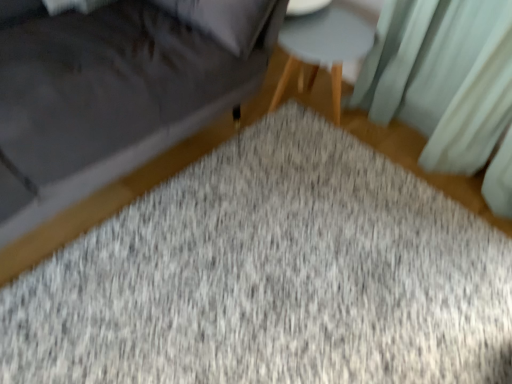
Identify the location of light gray wood stool at center. This screenshot has width=512, height=384. (322, 48).

Where is `velvet gray sofa at lower left`? This screenshot has height=384, width=512. velvet gray sofa at lower left is located at coordinates (159, 147).

You are a GUI agent. You are given a task and a screenshot of the screen. Output one action in this format:
    pyautogui.click(x=<x>, y=<y>)
    Task: Click on the gray textured mat at center
    
    Given the screenshot: What is the action you would take?
    pyautogui.click(x=272, y=277)

Which object is closer to the camera taking this photo, velvet gray sofa at lower left or gray textured mat at center?

velvet gray sofa at lower left.

Does velvet gray sofa at lower left have a greater width compared to gray textured mat at center?

No.

From the image's perspective, which is above, velvet gray sofa at lower left or gray textured mat at center?

velvet gray sofa at lower left appears higher in the image.

Is velvet gray sofa at lower left facing away from light gray wood stool at center?

No, velvet gray sofa at lower left is not facing the opposite direction of light gray wood stool at center.

Is velvet gray sofa at lower left touching light gray wood stool at center?

No, velvet gray sofa at lower left is not beside light gray wood stool at center.

Between velvet gray sofa at lower left and light gray wood stool at center, which one has smaller width?

With smaller width is light gray wood stool at center.

Is the depth of velvet gray sofa at lower left greater than that of light gray wood stool at center?

No, it is in front of light gray wood stool at center.

From the image's perspective, is light teal fabric curtain at upper right located beneath light gray wood stool at center?

Indeed, from the image's perspective, light teal fabric curtain at upper right is shown beneath light gray wood stool at center.

Would you say light teal fabric curtain at upper right is outside light gray wood stool at center?

Yes, light teal fabric curtain at upper right is not within light gray wood stool at center.

Is light teal fabric curtain at upper right far away from light gray wood stool at center?

light teal fabric curtain at upper right is actually quite close to light gray wood stool at center.

Which object is positioned more to the left, light teal fabric curtain at upper right or light gray wood stool at center?

From the viewer's perspective, light gray wood stool at center appears more on the left side.

The width and height of the screenshot is (512, 384). Identify the location of curtain that is below the light gray wood stool at center (from the image's perspective). (443, 77).

Is light teal fabric curtain at upper right at the back of light gray wood stool at center?

light gray wood stool at center is not turned away from light teal fabric curtain at upper right.

Is light gray wood stool at center far away from light teal fabric curtain at upper right?

They are positioned close to each other.

From the image's perspective, is light gray wood stool at center above light teal fabric curtain at upper right?

Yes, from the image's perspective, light gray wood stool at center is over light teal fabric curtain at upper right.

Which is behind, point (302, 78) or point (168, 151)?

The point (302, 78) is more distant.

What's the angular difference between light gray wood stool at center and velvet gray sofa at lower left's facing directions?

4.08e-05 degrees.

Is light gray wood stool at center wider or thinner than velvet gray sofa at lower left?

Clearly, light gray wood stool at center has less width compared to velvet gray sofa at lower left.

From a real-world perspective, is light gray wood stool at center physically above velvet gray sofa at lower left?

No.

Is gray textured mat at center not near velvet gray sofa at lower left?

No, there isn't a large distance between gray textured mat at center and velvet gray sofa at lower left.

Between point (448, 375) and point (139, 187), which one is positioned in front?

Positioned in front is point (448, 375).

From the picture: From the image's perspective, is gray textured mat at center over velvet gray sofa at lower left?

Actually, gray textured mat at center appears below velvet gray sofa at lower left in the image.

Can you tell me how much gray textured mat at center and velvet gray sofa at lower left differ in facing direction?

The angular difference between gray textured mat at center and velvet gray sofa at lower left is 180 degrees.

In terms of size, does light teal fabric curtain at upper right appear bigger or smaller than gray textured mat at center?

In the image, light teal fabric curtain at upper right appears to be smaller than gray textured mat at center.

Considering the sizes of light teal fabric curtain at upper right and gray textured mat at center in the image, is light teal fabric curtain at upper right taller or shorter than gray textured mat at center?

light teal fabric curtain at upper right is taller than gray textured mat at center.

Locate an element on the screen. The image size is (512, 384). curtain above the gray textured mat at center (from a real-world perspective) is located at coordinates click(x=443, y=77).

Is the depth of light teal fabric curtain at upper right greater than that of gray textured mat at center?

Yes, light teal fabric curtain at upper right is further from the viewer.

Locate an element on the screen. The height and width of the screenshot is (384, 512). mat directly beneath the velvet gray sofa at lower left (from a real-world perspective) is located at coordinates (272, 277).

Where is `furniture on the left of the light gray wood stool at center`? This screenshot has width=512, height=384. furniture on the left of the light gray wood stool at center is located at coordinates (159, 147).

Which object lies further to the anchor point light teal fabric curtain at upper right, velvet gray sofa at lower left or light gray wood stool at center?

Based on the image, velvet gray sofa at lower left appears to be further to light teal fabric curtain at upper right.

When comparing their distances from gray textured mat at center, does light teal fabric curtain at upper right or light gray wood stool at center seem further?

Among the two, light gray wood stool at center is located further to gray textured mat at center.

Which object lies further to the anchor point gray textured mat at center, velvet gray sofa at lower left or light gray wood stool at center?

Among the two, light gray wood stool at center is located further to gray textured mat at center.

Looking at the image, which one is located closer to light gray wood stool at center, light teal fabric curtain at upper right or velvet gray sofa at lower left?

Based on the image, light teal fabric curtain at upper right appears to be nearer to light gray wood stool at center.

Which object lies nearer to the anchor point light gray wood stool at center, velvet gray sofa at lower left or gray textured mat at center?

velvet gray sofa at lower left.

From the picture: When comparing their distances from light teal fabric curtain at upper right, does velvet gray sofa at lower left or gray textured mat at center seem further?

Based on the image, velvet gray sofa at lower left appears to be further to light teal fabric curtain at upper right.

Based on their spatial positions, is gray textured mat at center or light gray wood stool at center closer to velvet gray sofa at lower left?

light gray wood stool at center.

Which object lies nearer to the anchor point light teal fabric curtain at upper right, gray textured mat at center or light gray wood stool at center?

light gray wood stool at center.

What are the coordinates of `mat between velvet gray sofa at lower left and light teal fabric curtain at upper right` in the screenshot? It's located at (272, 277).

Locate an element on the screen. This screenshot has width=512, height=384. curtain that lies between light gray wood stool at center and gray textured mat at center from top to bottom is located at coordinates (443, 77).

Identify the location of mat between velvet gray sofa at lower left and light gray wood stool at center in the horizontal direction. The image size is (512, 384). (272, 277).

Image resolution: width=512 pixels, height=384 pixels. I want to click on side table located between velvet gray sofa at lower left and light teal fabric curtain at upper right in the left-right direction, so (322, 48).